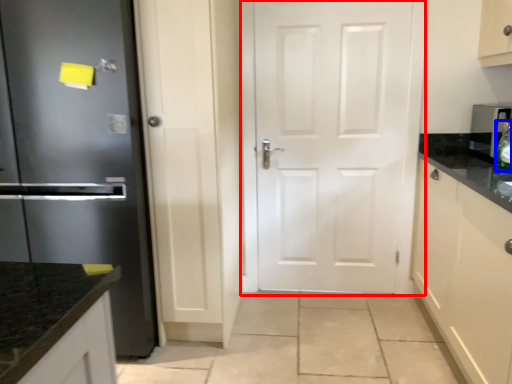
Question: Among these objects, which one is farthest to the camera, door (highlighted by a red box) or bottle (highlighted by a blue box)?

Choices:
 (A) door
 (B) bottle

Answer: (A)